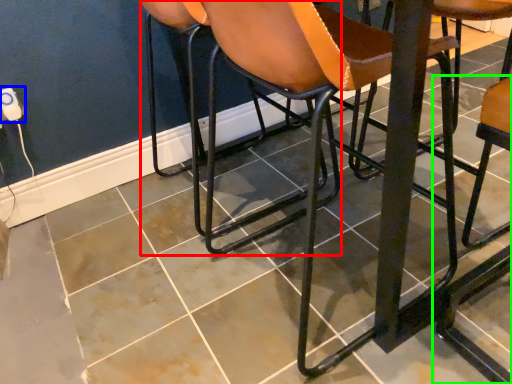
Question: Which object is the closest to the chair (highlighted by a red box)? Choose among these: electric outlet (highlighted by a blue box) or chair (highlighted by a green box).

Choices:
 (A) electric outlet
 (B) chair

Answer: (B)